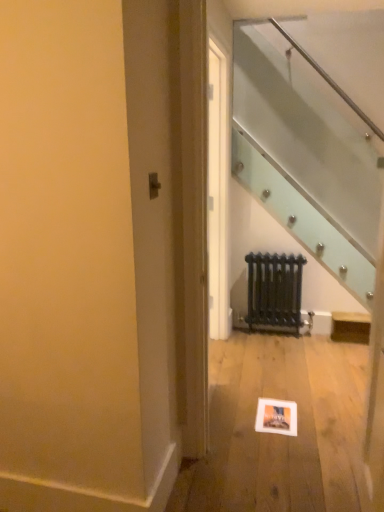
This screenshot has width=384, height=512. Find the location of `free spot in front of black metal radiator at center`. free spot in front of black metal radiator at center is located at coordinates click(266, 348).